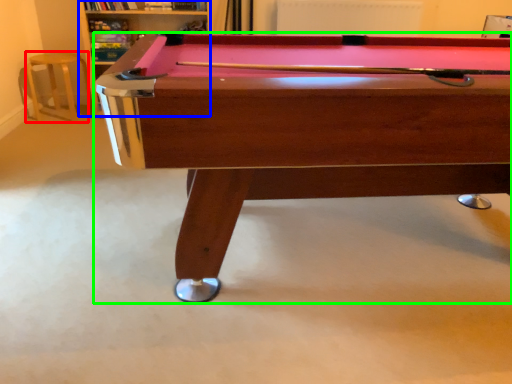
Question: Which is nearer to the bar stool (highlighted by a red box)? shelf (highlighted by a blue box) or billiard table (highlighted by a green box).

Choices:
 (A) shelf
 (B) billiard table

Answer: (A)